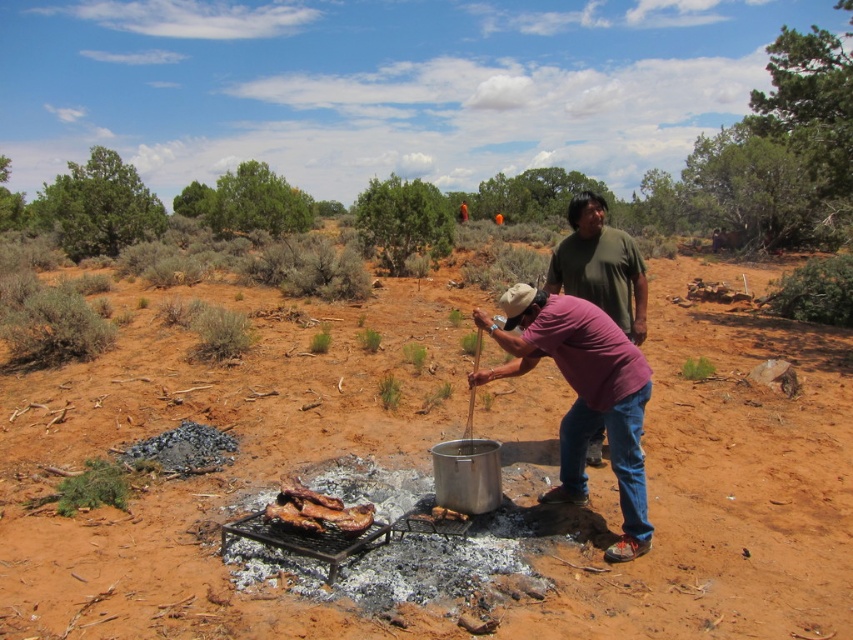
Between dirt field at center and purple cotton shirt at center, which one is positioned lower?

purple cotton shirt at center is lower down.

Is dirt field at center wider than purple cotton shirt at center?

Indeed, dirt field at center has a greater width compared to purple cotton shirt at center.

Does point (457, 401) lie in front of point (635, 554)?

No, (457, 401) is further to viewer.

At what (x,y) coordinates should I click in order to perform the action: click on dirt field at center. Please return your answer as a coordinate pair (x, y). The height and width of the screenshot is (640, 853). Looking at the image, I should click on (213, 472).

Who is taller, purple cotton shirt at center or charred wood at center?

purple cotton shirt at center is taller.

Find the location of `purple cotton shirt at center`. purple cotton shirt at center is located at coordinates (x=582, y=396).

Between dirt field at center and charred wood at center, which one is positioned higher?

dirt field at center

Does dirt field at center appear on the right side of charred wood at center?

Correct, you'll find dirt field at center to the right of charred wood at center.

Is point (248, 448) less distant than point (347, 516)?

No, (248, 448) is further to viewer.

Where is `dirt field at center`? This screenshot has height=640, width=853. dirt field at center is located at coordinates (213, 472).